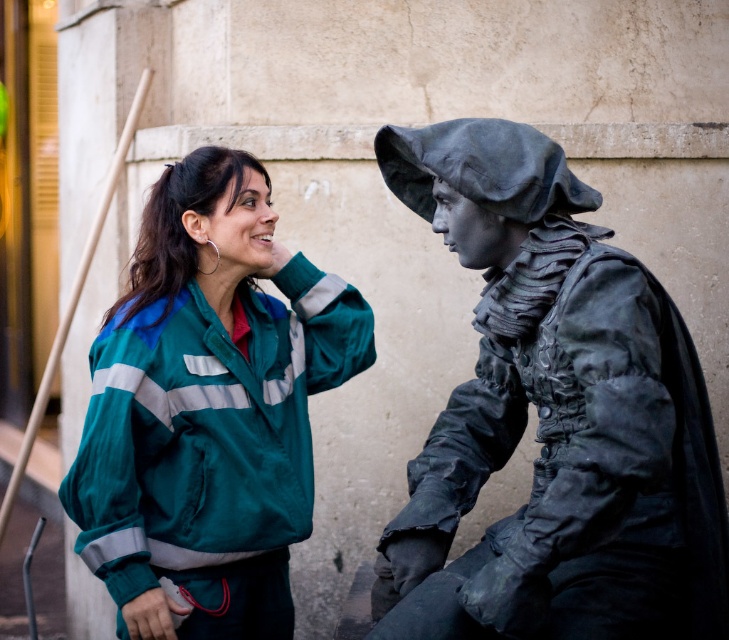
You are a photographer trying to capture a clear shot of both the black matte statue at right and the green fabric jacket at center. Since you want both subjects to be in focus, which one should you adjust your camera focus on first?

The black matte statue at right is closer to the viewer than the green fabric jacket at center, so you should focus on the black matte statue at right first to ensure both are in focus.

You are a photographer trying to capture both the black matte statue at right and the green fabric jacket at center in a single frame. Which object should you focus on first to ensure both are in the frame without moving the camera?

The black matte statue at right is bigger than the green fabric jacket at center, so you should focus on the black matte statue at right first to ensure both are in the frame without moving the camera.